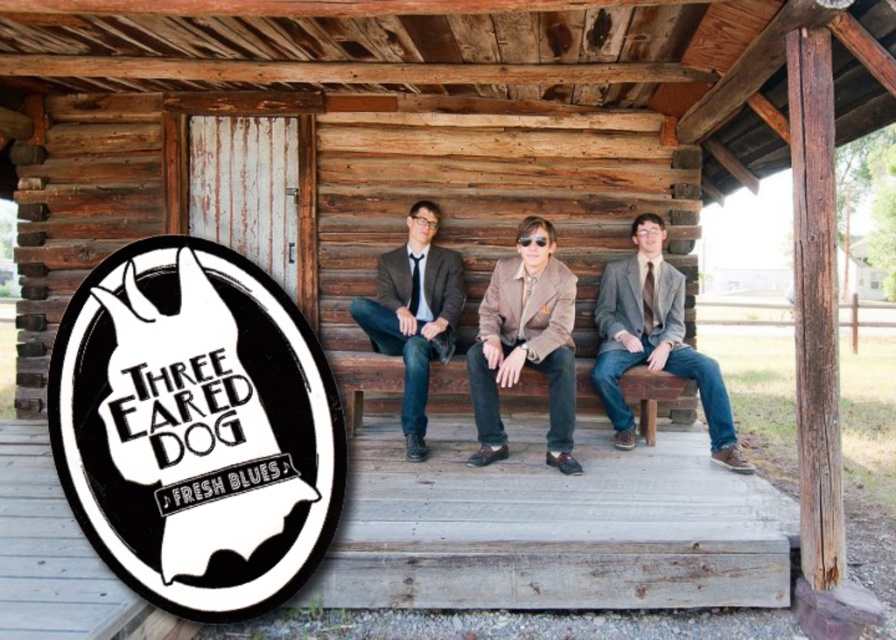
Question: In this image, where is matte gray suit at center located relative to matte gray blazer at center?

Choices:
 (A) right
 (B) left

Answer: (A)

Question: Estimate the real-world distances between objects in this image. Which object is closer to the matte gray suit at center?

Choices:
 (A) matte gray blazer at center
 (B) black paper sign at left
 (C) brown suede jacket at center

Answer: (C)

Question: Which object is the farthest from the matte gray suit at center?

Choices:
 (A) black paper sign at left
 (B) brown wooden bench at center
 (C) brown suede jacket at center

Answer: (A)

Question: Which of the following is the closest to the observer?

Choices:
 (A) (326, 376)
 (B) (659, 374)
 (C) (636, 228)

Answer: (A)

Question: Is brown suede jacket at center thinner than brown wooden bench at center?

Choices:
 (A) yes
 (B) no

Answer: (A)

Question: Does brown suede jacket at center appear on the right side of matte gray blazer at center?

Choices:
 (A) no
 (B) yes

Answer: (B)